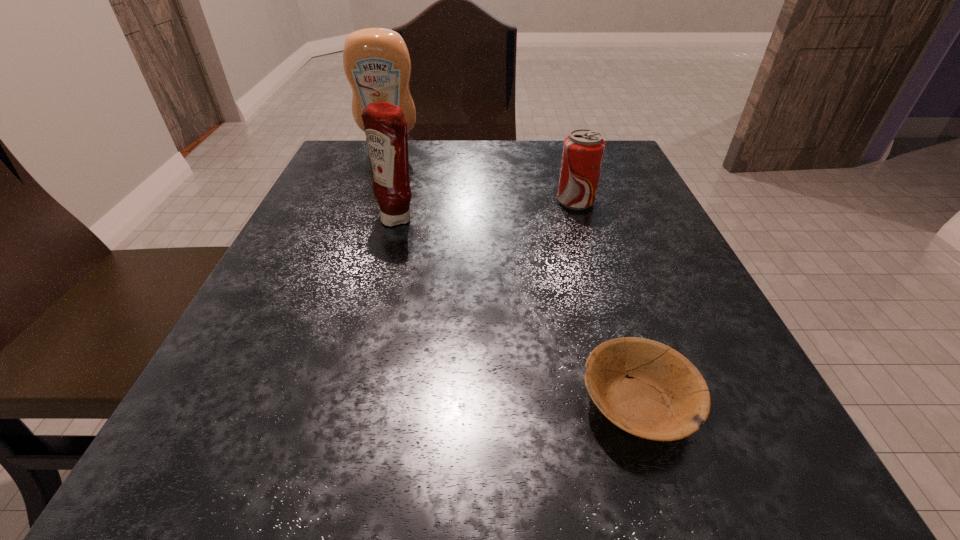
The height and width of the screenshot is (540, 960). In order to click on blank area in the image that satisfies the following two spatial constraints: 1. on the label of the tallest object; 2. on the right side of the nearer condiment in this screenshot , I will do `click(366, 218)`.

Where is `vacant space that satisfies the following two spatial constraints: 1. on the label of the farthest object; 2. on the left side of the shorter condiment`? Image resolution: width=960 pixels, height=540 pixels. vacant space that satisfies the following two spatial constraints: 1. on the label of the farthest object; 2. on the left side of the shorter condiment is located at coordinates (366, 218).

The height and width of the screenshot is (540, 960). What are the coordinates of `vacant region that satisfies the following two spatial constraints: 1. on the label of the nearest object; 2. on the left side of the farther condiment` in the screenshot? It's located at (300, 403).

Where is `free location that satisfies the following two spatial constraints: 1. on the label of the soda can; 2. on the left side of the taller condiment`? This screenshot has width=960, height=540. free location that satisfies the following two spatial constraints: 1. on the label of the soda can; 2. on the left side of the taller condiment is located at coordinates (372, 202).